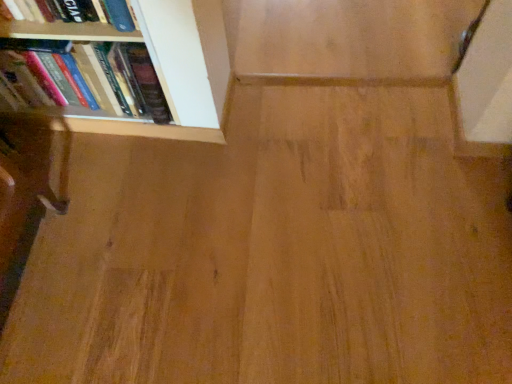
Measure the distance between point (169,57) and camera.

Point (169,57) is 1.17 meters away from camera.

What is the approximate width of wooden bookcase at upper left?

wooden bookcase at upper left is 22.98 centimeters wide.

Where is `wooden bookcase at upper left`? wooden bookcase at upper left is located at coordinates (211, 55).

This screenshot has width=512, height=384. Describe the element at coordinates (211, 55) in the screenshot. I see `wooden bookcase at upper left` at that location.

Locate an element on the screen. This screenshot has height=384, width=512. wooden bookcase at upper left is located at coordinates (211, 55).